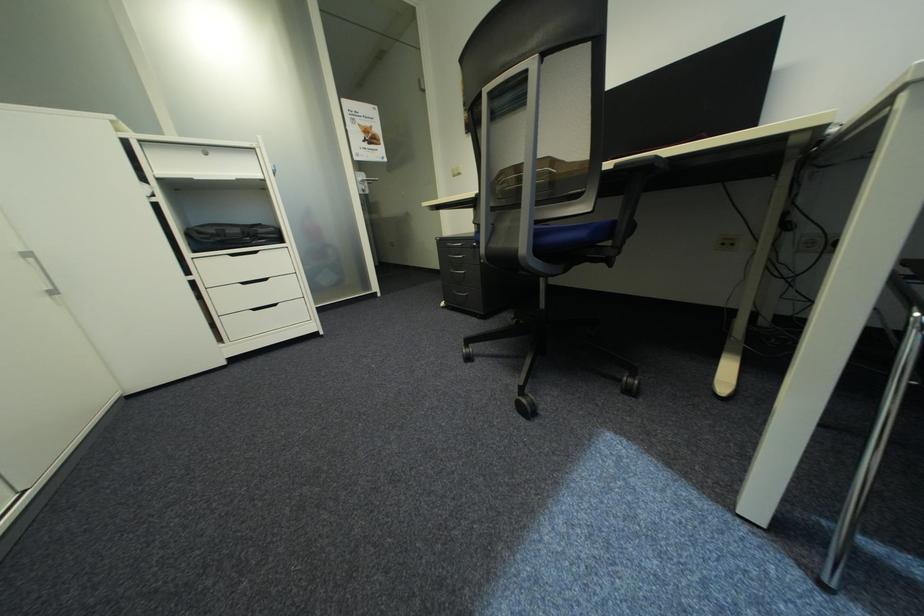
What do you see at coordinates (370, 377) in the screenshot?
I see `a metal door handle` at bounding box center [370, 377].